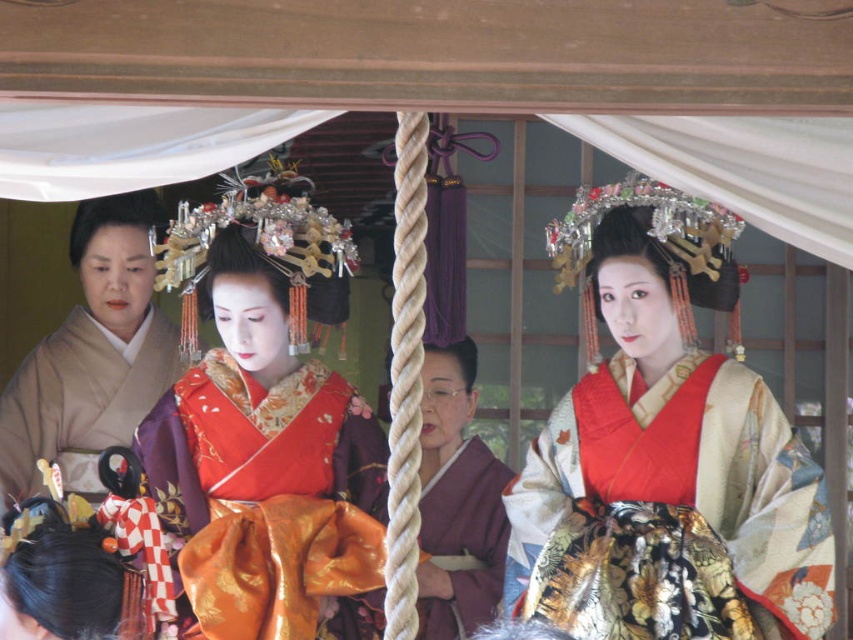
Which is more to the left, silky silk kimono at center or silky purple kimono at left?

Positioned to the left is silky purple kimono at left.

Is silky silk kimono at center above silky purple kimono at left?

Yes.

Is point (741, 484) in front of point (67, 428)?

Yes, it is.

At what (x,y) coordinates should I click in order to perform the action: click on silky silk kimono at center. Please return your answer as a coordinate pair (x, y). Looking at the image, I should click on (664, 452).

Is silky orange kimono at center shorter than matte purple kimono at center?

Incorrect, silky orange kimono at center's height does not fall short of matte purple kimono at center's.

Does silky orange kimono at center have a lesser width compared to matte purple kimono at center?

In fact, silky orange kimono at center might be wider than matte purple kimono at center.

The width and height of the screenshot is (853, 640). I want to click on silky orange kimono at center, so click(x=268, y=465).

Is silky purple kimono at left wider than matte purple kimono at center?

Yes.

Can you confirm if silky purple kimono at left is positioned to the left of matte purple kimono at center?

Correct, you'll find silky purple kimono at left to the left of matte purple kimono at center.

Who is more forward, (x=51, y=364) or (x=497, y=531)?

Point (x=497, y=531) is in front.

You are a GUI agent. You are given a task and a screenshot of the screen. Output one action in this format:
    pyautogui.click(x=<x>, y=<y>)
    Task: Click on the silky purple kimono at left
    The width and height of the screenshot is (853, 640).
    Given the screenshot: What is the action you would take?
    pyautogui.click(x=80, y=397)